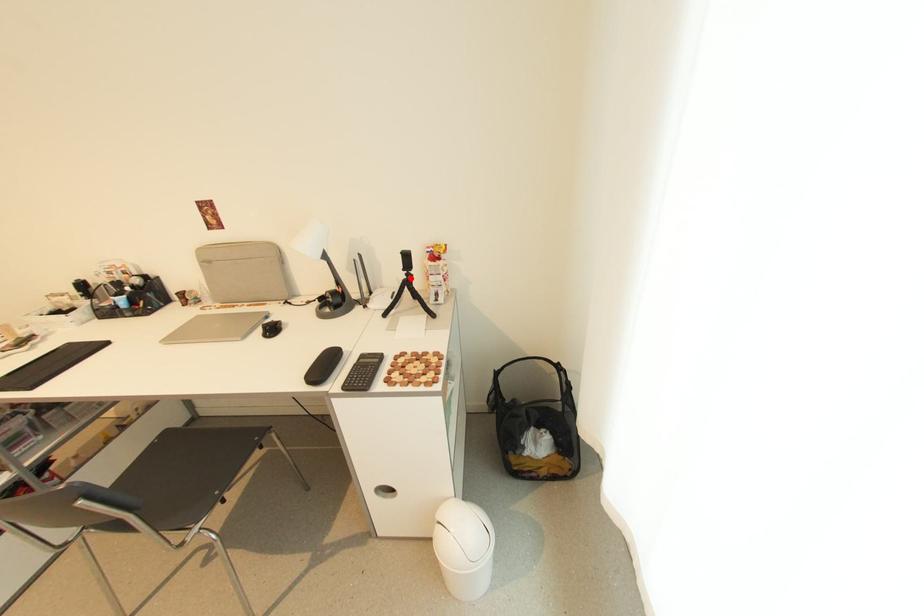
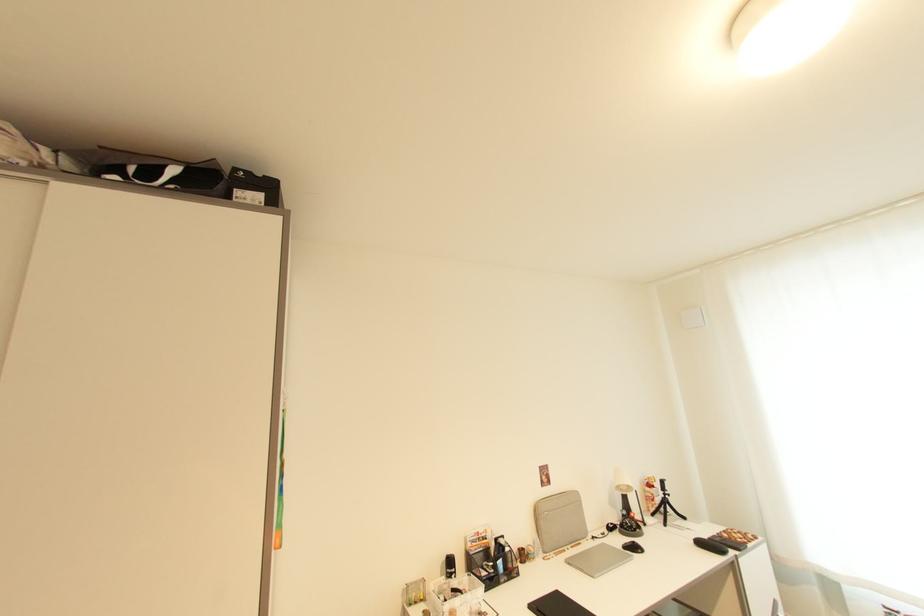
In the second image, find the point that corresponds to the highlighted location in the first image.

(669, 498)